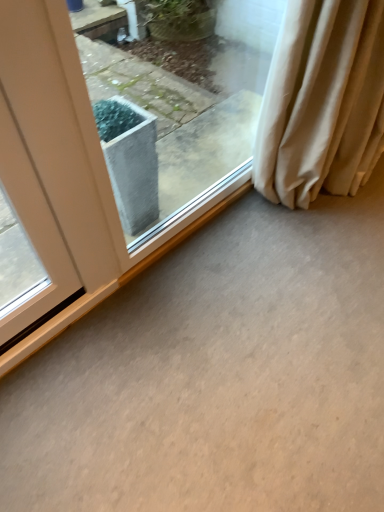
Question: From the image's perspective, is beige fabric curtain at right located above or below gray concrete at center?

Choices:
 (A) below
 (B) above

Answer: (B)

Question: Looking at their shapes, would you say beige fabric curtain at right is wider or thinner than gray concrete at center?

Choices:
 (A) thin
 (B) wide

Answer: (A)

Question: Which of these objects is positioned farthest from the beige fabric curtain at right?

Choices:
 (A) transparent glass window at center
 (B) gray concrete at center

Answer: (B)

Question: Which object is the closest to the transparent glass window at center?

Choices:
 (A) beige fabric curtain at right
 (B) gray concrete at center

Answer: (A)